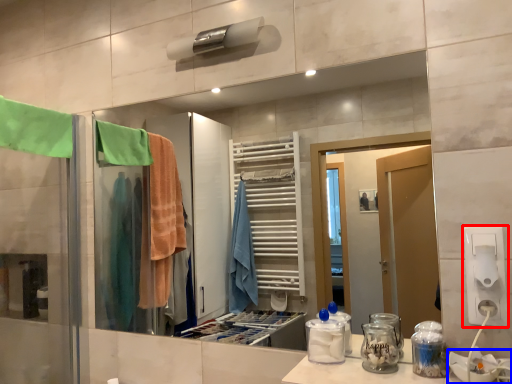
Question: Which object appears farthest to the camera in this image, electric outlet (highlighted by a red box) or sink (highlighted by a blue box)?

Choices:
 (A) electric outlet
 (B) sink

Answer: (A)